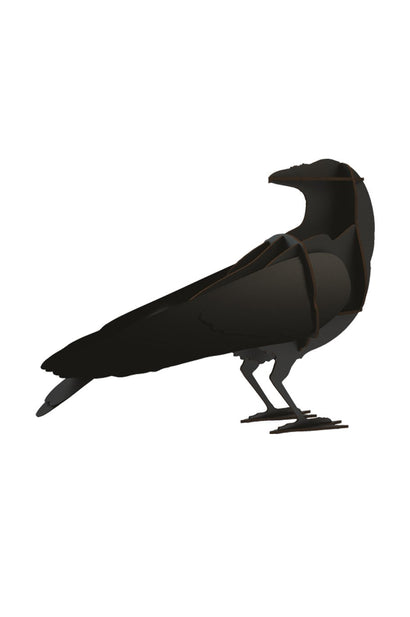
Where is `sculpture`? This screenshot has width=410, height=617. sculpture is located at coordinates (340, 200).